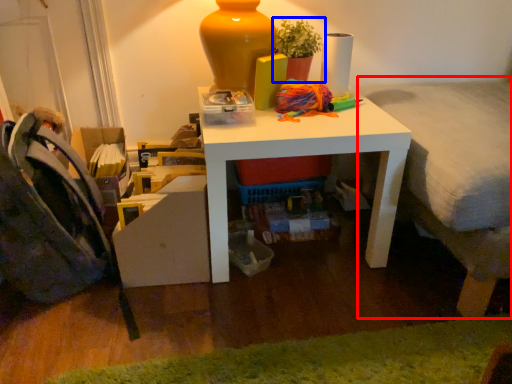
Question: Which object is further to the camera taking this photo, bed (highlighted by a red box) or houseplant (highlighted by a blue box)?

Choices:
 (A) bed
 (B) houseplant

Answer: (B)